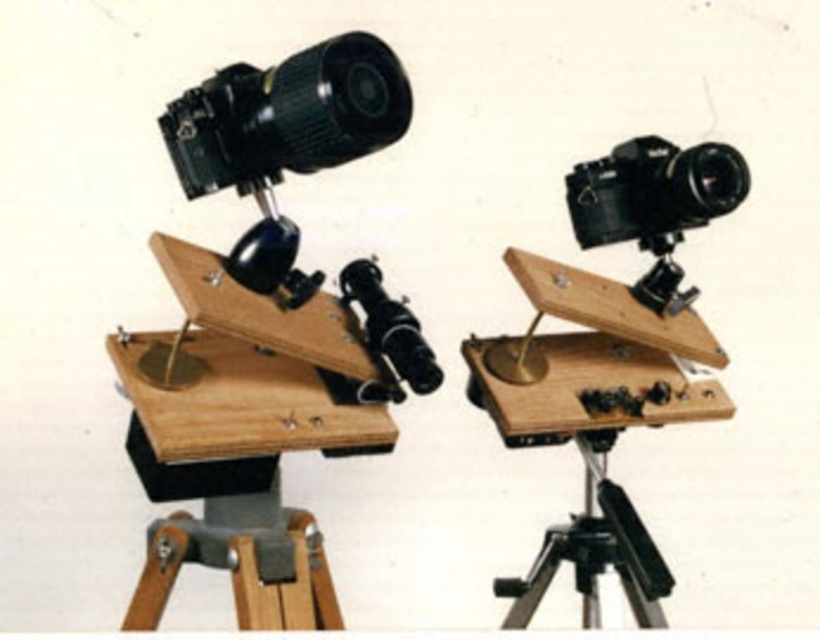
You are an astrophotographer setting up two camera platforms. The black plastic camera at upper left is part of your setup. If you want to place a second camera exactly 1.63 meters away from it, where should you position the second camera?

The second camera should be positioned at the other platform, as they are 1.63 meters apart.

What object is located at the coordinates point (x=654, y=192)?

The point (x=654, y=192) indicates the black matte camera at center.

You are setting up an astrophotography setup and need to know which object is shorter between the black plastic camera at upper left and the black metal tripod at lower right. Could you tell me which one is shorter?

The black plastic camera at upper left has a lesser height compared to the black metal tripod at lower right, so the black plastic camera at upper left is shorter.